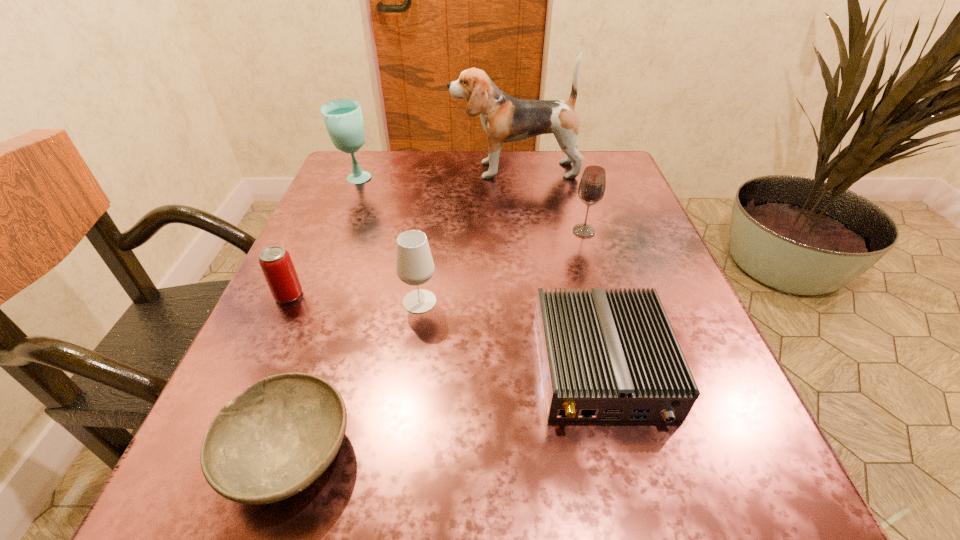
Where is `vacant area situated at the face of the puppy`? This screenshot has width=960, height=540. vacant area situated at the face of the puppy is located at coordinates (406, 170).

Locate an element on the screen. This screenshot has height=540, width=960. vacant space situated at the face of the puppy is located at coordinates (385, 170).

You are a GUI agent. You are given a task and a screenshot of the screen. Output one action in this format:
    pyautogui.click(x=<x>, y=<y>)
    Task: Click on the vacant space located 0.260m at the face of the puppy
    Image resolution: width=960 pixels, height=540 pixels.
    Given the screenshot: What is the action you would take?
    pyautogui.click(x=345, y=170)

The height and width of the screenshot is (540, 960). Find the location of `free space located on the front of the second tallest object`. free space located on the front of the second tallest object is located at coordinates (334, 233).

You are a GUI agent. You are given a task and a screenshot of the screen. Output one action in this format:
    pyautogui.click(x=<x>, y=<y>)
    Task: Click on the vacant space situated on the front of the second nearest glass
    The height and width of the screenshot is (540, 960).
    Given the screenshot: What is the action you would take?
    pyautogui.click(x=604, y=299)

You are a GUI agent. You are given a task and a screenshot of the screen. Output one action in this format:
    pyautogui.click(x=<x>, y=<y>)
    Task: Click on the vacant space situated on the back of the fourth object from right to left
    This screenshot has height=540, width=960.
    Given the screenshot: What is the action you would take?
    pyautogui.click(x=438, y=177)

Where is `free space located on the right of the third shortest object`? The image size is (960, 540). free space located on the right of the third shortest object is located at coordinates (461, 295).

The height and width of the screenshot is (540, 960). What are the coordinates of `vacant area situated on the back panel of the router` in the screenshot? It's located at (639, 516).

Locate an element on the screen. The width and height of the screenshot is (960, 540). vacant space positioned on the back of the bowl is located at coordinates 324,352.

Locate an element on the screen. Image resolution: width=960 pixels, height=540 pixels. puppy that is at the far edge is located at coordinates (504, 118).